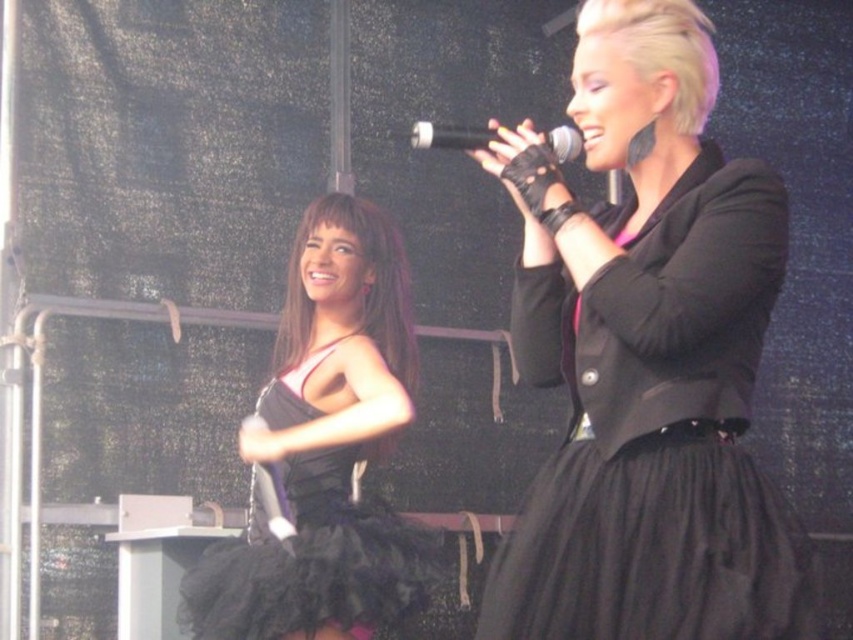
Question: Estimate the real-world distances between objects in this image. Which object is farther from the black matte microphone at upper center?

Choices:
 (A) black tulle dress at left
 (B) black tulle dress at upper right

Answer: (A)

Question: Is black tulle dress at left above black matte microphone at upper center?

Choices:
 (A) no
 (B) yes

Answer: (A)

Question: Is black tulle dress at upper right to the left of black tulle dress at left from the viewer's perspective?

Choices:
 (A) yes
 (B) no

Answer: (B)

Question: Which object appears farthest from the camera in this image?

Choices:
 (A) black tulle dress at left
 (B) black tulle dress at upper right

Answer: (A)

Question: Which point is closer to the camera?

Choices:
 (A) black tulle dress at upper right
 (B) black matte microphone at upper center
 (C) black tulle dress at left

Answer: (A)

Question: Is black tulle dress at left smaller than black matte microphone at upper center?

Choices:
 (A) yes
 (B) no

Answer: (B)